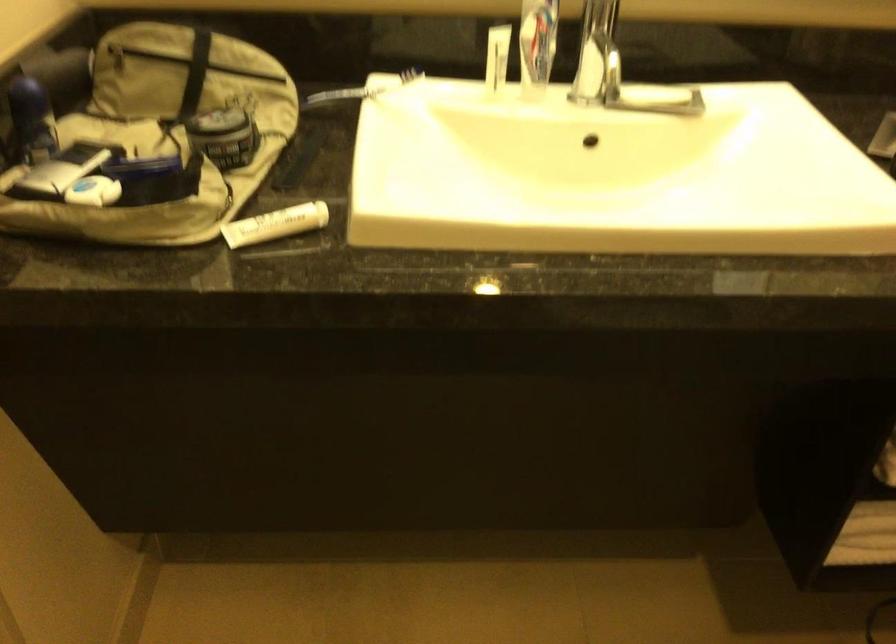
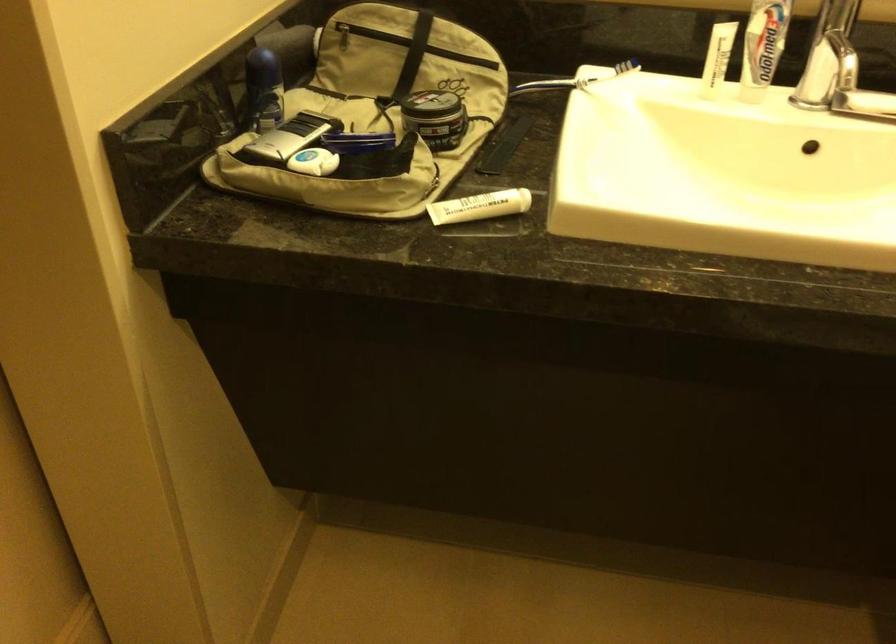
Question: The images are taken continuously from a first-person perspective. In which direction are you moving?

Choices:
 (A) Left
 (B) Right
 (C) Forward
 (D) Backward

Answer: (A)